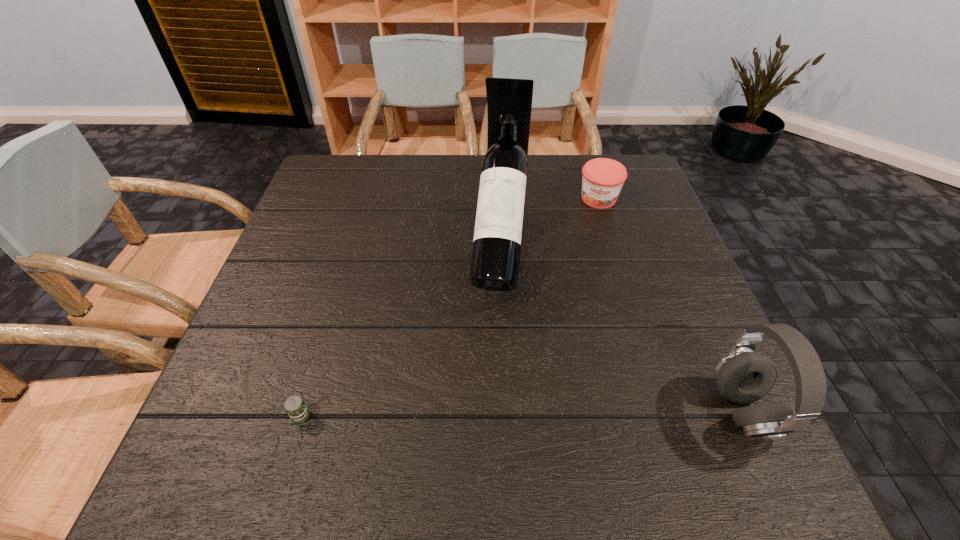
This screenshot has width=960, height=540. I want to click on the third closest object to the leftmost object, so click(x=602, y=180).

The width and height of the screenshot is (960, 540). In order to click on the second closest object relative to the second object from left to right in this screenshot , I will do `click(295, 407)`.

Image resolution: width=960 pixels, height=540 pixels. Identify the location of free space in the image that satisfies the following two spatial constraints: 1. on the front side of the tallest object; 2. on the ear cups of the rightmost object. (507, 411).

Locate an element on the screen. This screenshot has height=540, width=960. vacant area in the image that satisfies the following two spatial constraints: 1. on the back side of the second object from right to left; 2. on the right side of the tallest object is located at coordinates (497, 199).